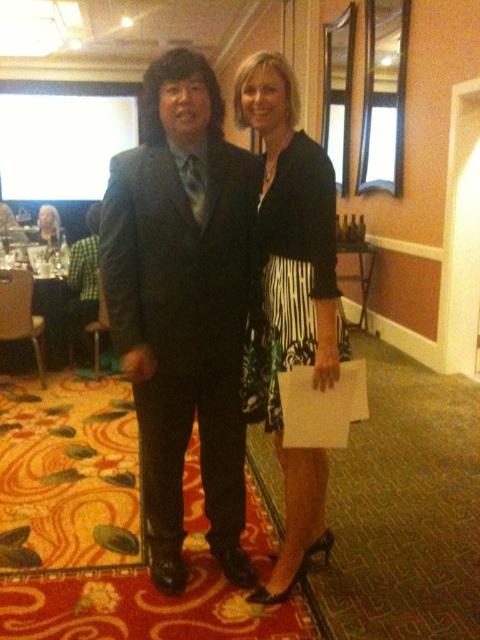
You are organizing a photo shoot and need to place a large prop between the shiny black suit at center and the black satin dress at center. Which object should the prop be placed closer to to ensure it doesn t block either subject?

The prop should be placed closer to the shiny black suit at center because it is larger in size than the black satin dress at center, allowing more space around it without blocking either subject.

You are a photographer at a formal event and need to capture a photo of both the black satin dress at center and the matte black dress at center. If the camera frame can only fit items up to the width of the wider dress, will both dresses fit in the frame?

The black satin dress at center is narrower than the matte black dress at center. Since the camera frame can accommodate the width of the wider matte black dress at center, both dresses will fit within the frame as the black satin dress at center is narrower.